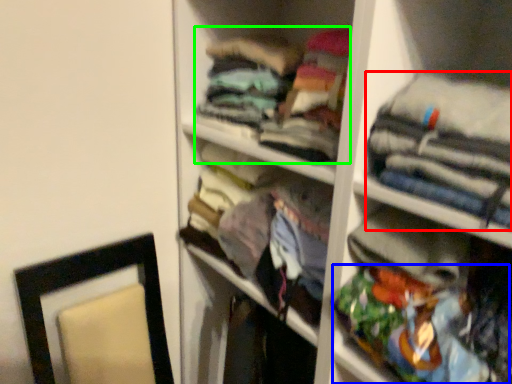
Question: Based on their relative distances, which object is farther from clothing (highlighted by a red box)? Choose from clothing (highlighted by a blue box) and clothing (highlighted by a green box).

Choices:
 (A) clothing
 (B) clothing

Answer: (B)